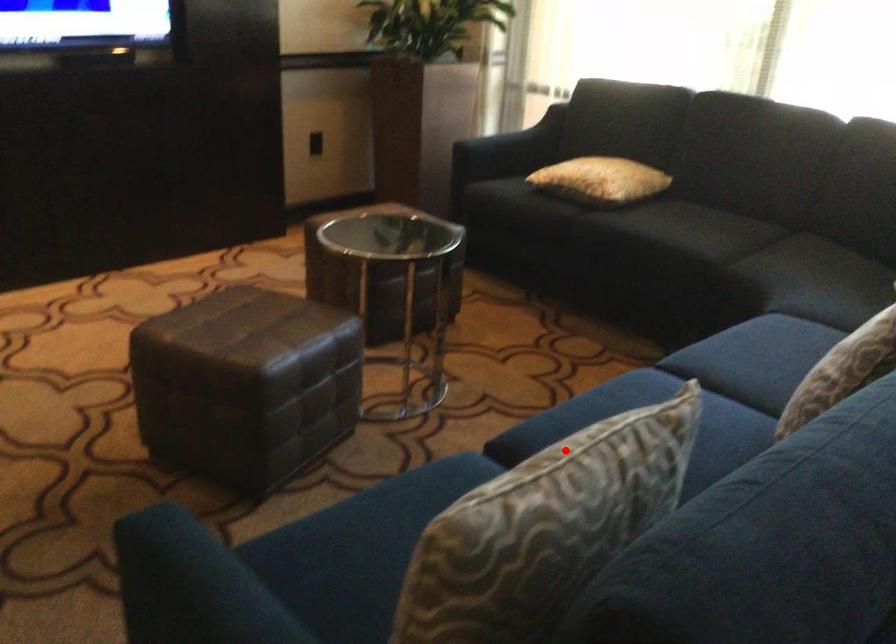
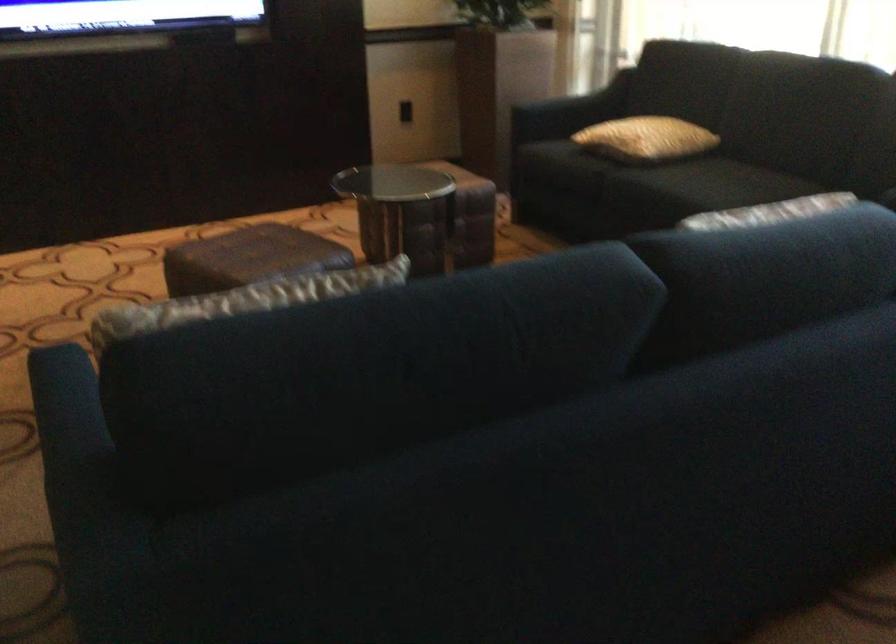
In the second image, find the point that corresponds to the highlighted location in the first image.

(252, 298)